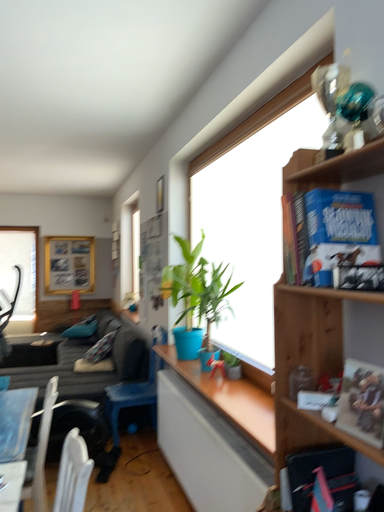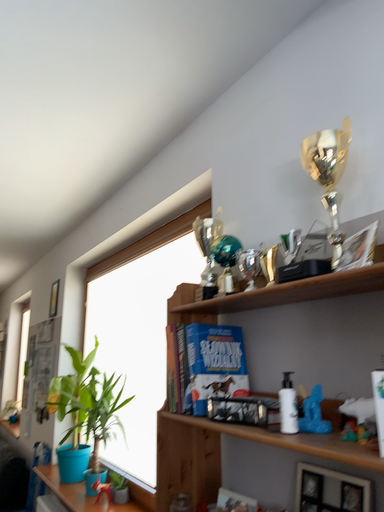
Question: Which way did the camera rotate in the video?

Choices:
 (A) rotated left
 (B) rotated right

Answer: (B)